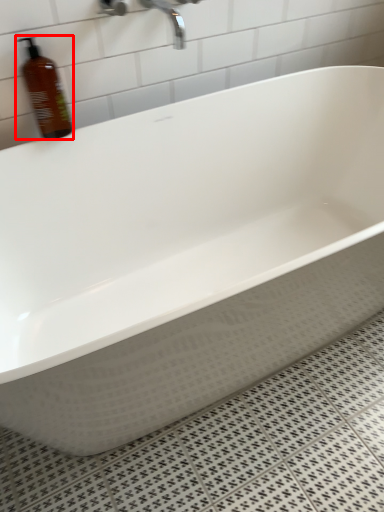
Question: Observing the image, what is the correct spatial positioning of bottle (annotated by the red box) in reference to faucet?

Choices:
 (A) right
 (B) left

Answer: (B)